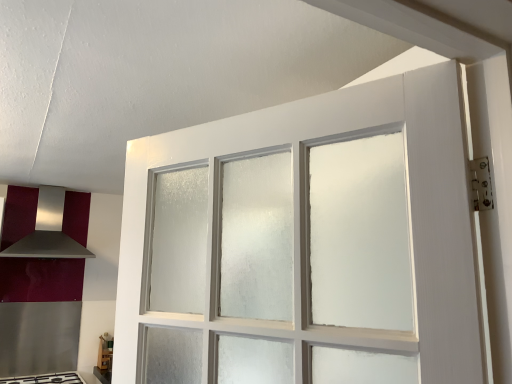
Question: Based on their positions, is satin silver exhaust hood at left located to the left or right of white glossy gas stove at lower left?

Choices:
 (A) right
 (B) left

Answer: (B)

Question: Considering their positions, is satin silver exhaust hood at left located in front of or behind white glossy gas stove at lower left?

Choices:
 (A) behind
 (B) front

Answer: (A)

Question: Is point (38, 200) positioned closer to the camera than point (17, 380)?

Choices:
 (A) closer
 (B) farther

Answer: (B)

Question: Considering their positions, is white glossy gas stove at lower left located in front of or behind satin silver exhaust hood at left?

Choices:
 (A) front
 (B) behind

Answer: (A)

Question: Considering the relative positions of white glossy gas stove at lower left and satin silver exhaust hood at left in the image provided, is white glossy gas stove at lower left to the left or to the right of satin silver exhaust hood at left?

Choices:
 (A) right
 (B) left

Answer: (A)

Question: Is white glossy gas stove at lower left wider or thinner than satin silver exhaust hood at left?

Choices:
 (A) wide
 (B) thin

Answer: (A)

Question: From a real-world perspective, is white glossy gas stove at lower left physically located above or below satin silver exhaust hood at left?

Choices:
 (A) above
 (B) below

Answer: (B)